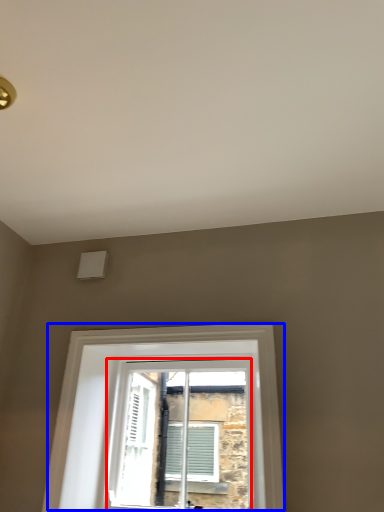
Question: Which of the following is the farthest to the observer, window (highlighted by a red box) or window (highlighted by a blue box)?

Choices:
 (A) window
 (B) window

Answer: (A)